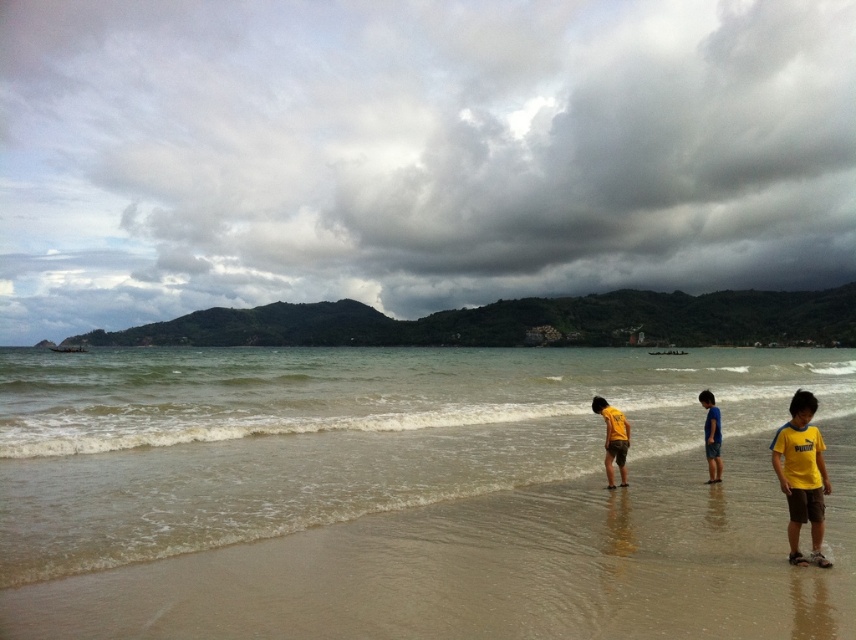
Is clear water at lower center to the left of yellow cotton shirt at lower right from the viewer's perspective?

Indeed, clear water at lower center is positioned on the left side of yellow cotton shirt at lower right.

Does clear water at lower center lie in front of yellow cotton shirt at lower right?

No, clear water at lower center is further to the viewer.

Find the location of `clear water at lower center`. clear water at lower center is located at coordinates (337, 435).

This screenshot has height=640, width=856. In order to click on clear water at lower center in this screenshot , I will do `click(337, 435)`.

Which is above, yellow cotton shirt at lower right or blue cotton shorts at lower right?

yellow cotton shirt at lower right is higher up.

Looking at this image, is yellow cotton shirt at lower right to the left of blue cotton shorts at lower right from the viewer's perspective?

Incorrect, yellow cotton shirt at lower right is not on the left side of blue cotton shorts at lower right.

Find the location of a particular element. The image size is (856, 640). yellow cotton shirt at lower right is located at coordinates (801, 476).

From the picture: Which is above, yellow matte shirt at center or blue cotton shorts at lower right?

yellow matte shirt at center is above.

Can you confirm if yellow matte shirt at center is positioned to the right of blue cotton shorts at lower right?

Incorrect, yellow matte shirt at center is not on the right side of blue cotton shorts at lower right.

Describe the element at coordinates (613, 438) in the screenshot. I see `yellow matte shirt at center` at that location.

Where is `yellow matte shirt at center`? yellow matte shirt at center is located at coordinates (613, 438).